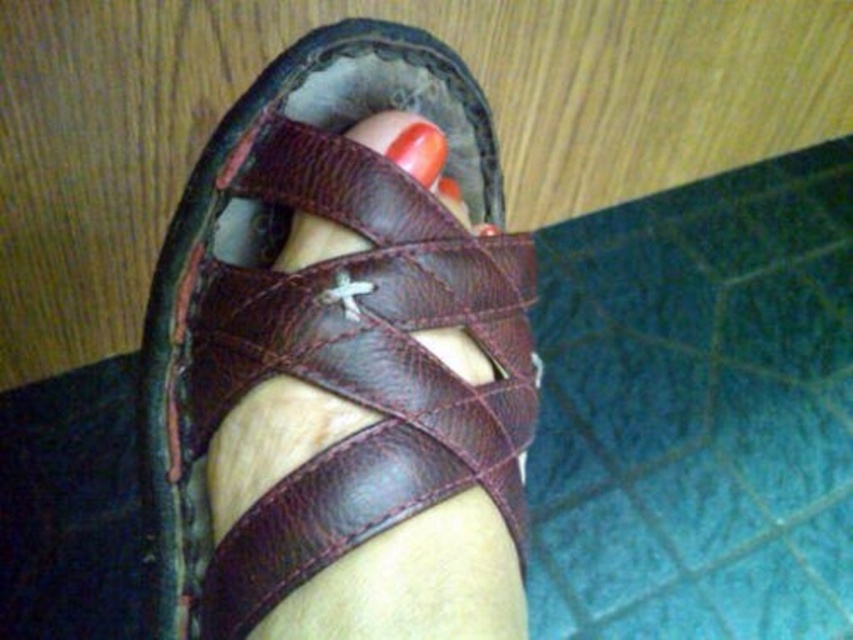
Question: Which point is closer to the camera?

Choices:
 (A) glossy orange nail at center
 (B) brown leather sandal at center

Answer: (B)

Question: Can you confirm if brown leather sandal at center is positioned to the left of glossy orange nail at center?

Choices:
 (A) no
 (B) yes

Answer: (B)

Question: Observing the image, what is the correct spatial positioning of brown leather sandal at center in reference to glossy orange nail at center?

Choices:
 (A) right
 (B) left

Answer: (B)

Question: Does brown leather sandal at center have a greater width compared to glossy orange nail at center?

Choices:
 (A) yes
 (B) no

Answer: (A)

Question: Which point appears closest to the camera in this image?

Choices:
 (A) (415, 144)
 (B) (296, 566)

Answer: (B)